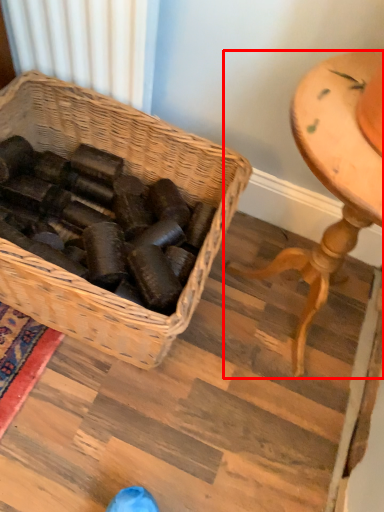
Question: In this image, where is furniture (annotated by the red box) located relative to picnic basket?

Choices:
 (A) left
 (B) right

Answer: (B)